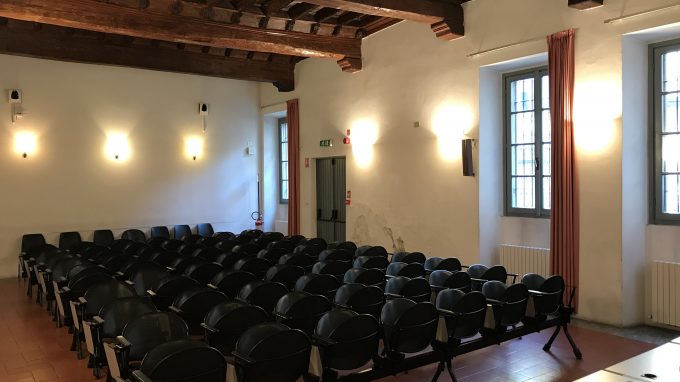
I want to click on window, so click(x=508, y=175).